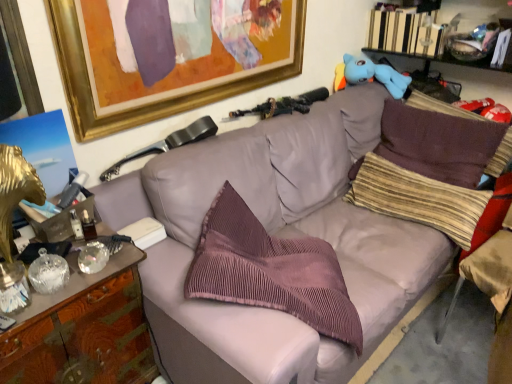
What do you see at coordinates (405, 32) in the screenshot?
I see `hardcover book at upper right, positioned as the first book in back-to-front order` at bounding box center [405, 32].

Consider the image. In order to face striped fabric pillow at right, the 2th pillow from the right, should I rotate leftwards or rightwards?

You should look right and rotate roughly 20.754 degrees.

Describe the element at coordinates (370, 75) in the screenshot. The height and width of the screenshot is (384, 512). I see `blue plush toy at upper right` at that location.

The image size is (512, 384). Find the location of `matte gray swivel chair at upper center`. matte gray swivel chair at upper center is located at coordinates (168, 143).

Describe the element at coordinates (270, 271) in the screenshot. I see `pink corduroy pillow at center, acting as the 1th pillow starting from the left` at that location.

What do you see at coordinates (144, 232) in the screenshot? The width and height of the screenshot is (512, 384). I see `white paper at center, which ranks as the 1th book in front-to-back order` at bounding box center [144, 232].

I want to click on white paper at center, arranged as the first book when viewed from the left, so click(x=144, y=232).

The height and width of the screenshot is (384, 512). I want to click on wooden cabinet at left, so click(x=84, y=330).

From the picture: What is the approximate height of matte gray couch at center?

33.42 inches.

This screenshot has width=512, height=384. Identify the location of hardcover book at upper right, which is counted as the 2th book, starting from the left. (405, 32).

Is matte gray swivel chair at upper center at the back of wooden cabinet at left?

wooden cabinet at left does not have its back to matte gray swivel chair at upper center.

From a real-world perspective, who is located lower, wooden cabinet at left or matte gray swivel chair at upper center?

wooden cabinet at left, from a real-world perspective.

Looking at this image, is wooden cabinet at left in contact with matte gray swivel chair at upper center?

No, wooden cabinet at left is not in contact with matte gray swivel chair at upper center.

Is wooden cabinet at left located outside matte gray swivel chair at upper center?

Yes, wooden cabinet at left is located beyond the bounds of matte gray swivel chair at upper center.

In terms of width, does brown corduroy pillow at right, which appears as the 1th pillow when viewed from the right, look wider or thinner when compared to matte gray couch at center?

brown corduroy pillow at right, which appears as the 1th pillow when viewed from the right, is thinner than matte gray couch at center.

Where is `studio couch that appears on the left of brown corduroy pillow at right, the 3th pillow from the left`? This screenshot has width=512, height=384. studio couch that appears on the left of brown corduroy pillow at right, the 3th pillow from the left is located at coordinates [x=276, y=233].

Is brown corduroy pillow at right, which appears as the 1th pillow when viewed from the right, looking in the opposite direction of matte gray couch at center?

Correct, brown corduroy pillow at right, which appears as the 1th pillow when viewed from the right, is looking away from matte gray couch at center.

Considering their positions, is brown corduroy pillow at right, the 3th pillow from the left, located in front of or behind matte gray couch at center?

brown corduroy pillow at right, the 3th pillow from the left, is behind matte gray couch at center.

Is matte gray swivel chair at upper center looking in the opposite direction of blue plush toy at upper right?

No.

Is matte gray swivel chair at upper center situated inside blue plush toy at upper right or outside?

The correct answer is: outside.

Consider the image. Which is more to the left, matte gray swivel chair at upper center or blue plush toy at upper right?

matte gray swivel chair at upper center.

Which object is closer to the camera, matte gray swivel chair at upper center or blue plush toy at upper right?

matte gray swivel chair at upper center is more forward.

Looking at this image, from a real-world perspective, is hardcover book at upper right, positioned as the first book in back-to-front order, on top of matte gray couch at center?

Correct, in the physical world, hardcover book at upper right, positioned as the first book in back-to-front order, is higher than matte gray couch at center.

Consider the image. Does hardcover book at upper right, which is the 2th book from front to back, have a lesser height compared to matte gray couch at center?

Yes, hardcover book at upper right, which is the 2th book from front to back, is shorter than matte gray couch at center.

Is hardcover book at upper right, arranged as the first book when viewed from the top, positioned far away from matte gray couch at center?

No.

Where is `book on the right of the matte gray couch at center`? The width and height of the screenshot is (512, 384). book on the right of the matte gray couch at center is located at coordinates (405, 32).

In the scene shown: Between brown corduroy pillow at right, the 3th pillow from the left, and pink corduroy pillow at center, placed as the third pillow when sorted from right to left, which one has less height?

Standing shorter between the two is brown corduroy pillow at right, the 3th pillow from the left.

Is brown corduroy pillow at right, which appears as the 1th pillow when viewed from the right, positioned beyond the bounds of pink corduroy pillow at center, acting as the 1th pillow starting from the left?

brown corduroy pillow at right, which appears as the 1th pillow when viewed from the right, lies outside pink corduroy pillow at center, acting as the 1th pillow starting from the left,'s area.

In the scene shown: Relative to pink corduroy pillow at center, acting as the 1th pillow starting from the left, is brown corduroy pillow at right, which appears as the 1th pillow when viewed from the right, in front or behind?

Visually, brown corduroy pillow at right, which appears as the 1th pillow when viewed from the right, is located behind pink corduroy pillow at center, acting as the 1th pillow starting from the left.

Is white paper at center, which is the first book in bottom-to-top order, shorter than brown corduroy pillow at right, which appears as the 1th pillow when viewed from the right?

Indeed, white paper at center, which is the first book in bottom-to-top order, has a lesser height compared to brown corduroy pillow at right, which appears as the 1th pillow when viewed from the right.

Which object is wider, white paper at center, which is the first book in bottom-to-top order, or brown corduroy pillow at right, the 3th pillow from the left?

brown corduroy pillow at right, the 3th pillow from the left, is wider.

Is point (144, 225) closer to camera compared to point (457, 135)?

That is True.

Does white paper at center, which ranks as the 1th book in front-to-back order, turn towards brown corduroy pillow at right, which appears as the 1th pillow when viewed from the right?

No, white paper at center, which ranks as the 1th book in front-to-back order, does not turn towards brown corduroy pillow at right, which appears as the 1th pillow when viewed from the right.

Is matte gray swivel chair at upper center taller or shorter than brown corduroy pillow at right, which appears as the 1th pillow when viewed from the right?

Considering their sizes, matte gray swivel chair at upper center has less height than brown corduroy pillow at right, which appears as the 1th pillow when viewed from the right.

Could you tell me if matte gray swivel chair at upper center is turned towards brown corduroy pillow at right, the 3th pillow from the left?

No, matte gray swivel chair at upper center is not oriented towards brown corduroy pillow at right, the 3th pillow from the left.

Between matte gray swivel chair at upper center and brown corduroy pillow at right, the 3th pillow from the left, which one is positioned in front?

Positioned in front is matte gray swivel chair at upper center.

Is matte gray swivel chair at upper center beside brown corduroy pillow at right, which appears as the 1th pillow when viewed from the right?

matte gray swivel chair at upper center and brown corduroy pillow at right, which appears as the 1th pillow when viewed from the right, are not in contact.

Where is `cabinetry on the left of matte gray swivel chair at upper center`? The height and width of the screenshot is (384, 512). cabinetry on the left of matte gray swivel chair at upper center is located at coordinates (84, 330).

From a real-world perspective, which pillow is the 3rd one above the matte gray couch at center? Please provide its 2D coordinates.

[(444, 144)]

When comparing their distances from striped fabric pillow at right, arranged as the second pillow when viewed from the left, does blue plush toy at upper right or white paper at center, the second book positioned from the top, seem further?

white paper at center, the second book positioned from the top.

Which object lies further to the anchor point matte gray swivel chair at upper center, brown corduroy pillow at right, the 3th pillow from the left, or goldmaterial/texturepicture frame at upper left?

Among the two, brown corduroy pillow at right, the 3th pillow from the left, is located further to matte gray swivel chair at upper center.

When comparing their distances from goldmaterial/texturepicture frame at upper left, does brown corduroy pillow at right, which appears as the 1th pillow when viewed from the right, or matte gray couch at center seem further?

Among the two, brown corduroy pillow at right, which appears as the 1th pillow when viewed from the right, is located further to goldmaterial/texturepicture frame at upper left.

Which object lies further to the anchor point matte gray couch at center, wooden cabinet at left or pink corduroy pillow at center, acting as the 1th pillow starting from the left?

The object further to matte gray couch at center is wooden cabinet at left.

From the image, which object appears to be nearer to matte gray swivel chair at upper center, pink corduroy pillow at center, acting as the 1th pillow starting from the left, or matte gray couch at center?

Among the two, matte gray couch at center is located nearer to matte gray swivel chair at upper center.

Looking at the image, which one is located closer to goldmaterial/texturepicture frame at upper left, white paper at center, arranged as the first book when viewed from the left, or matte gray couch at center?

matte gray couch at center is closer to goldmaterial/texturepicture frame at upper left.

Estimate the real-world distances between objects in this image. Which object is further from pink corduroy pillow at center, acting as the 1th pillow starting from the left, wooden cabinet at left or matte gray couch at center?

The object further to pink corduroy pillow at center, acting as the 1th pillow starting from the left, is wooden cabinet at left.

Looking at the image, which one is located further to brown corduroy pillow at right, the 3th pillow from the left, blue plush toy at upper right or pink corduroy pillow at center, acting as the 1th pillow starting from the left?

The object further to brown corduroy pillow at right, the 3th pillow from the left, is pink corduroy pillow at center, acting as the 1th pillow starting from the left.

The height and width of the screenshot is (384, 512). What are the coordinates of `studio couch situated between white paper at center, arranged as the first book when viewed from the left, and hardcover book at upper right, which is counted as the 2th book, starting from the left, from left to right` in the screenshot? It's located at 276,233.

Identify the location of swivel chair between white paper at center, the second book from the right, and matte gray couch at center. pos(168,143).

Locate an element on the screen. The height and width of the screenshot is (384, 512). pillow between matte gray couch at center and striped fabric pillow at right, arranged as the second pillow when viewed from the left, along the z-axis is located at coordinates (270, 271).

Find the location of a particular element. This screenshot has height=384, width=512. toy between wooden cabinet at left and hardcover book at upper right, the 2th book from the bottom is located at coordinates (370, 75).